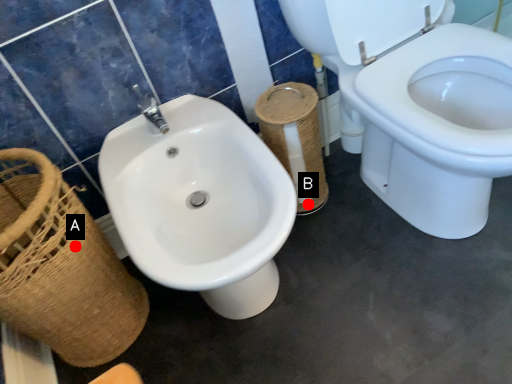
Question: Two points are circled on the image, labeled by A and B beside each circle. Which point appears farthest from the camera in this image?

Choices:
 (A) A is further
 (B) B is further

Answer: (B)